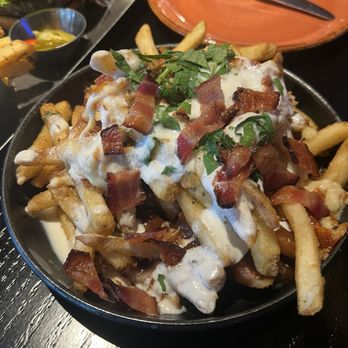
The image size is (348, 348). In order to click on shallow bowl in this screenshot , I will do `click(33, 237)`.